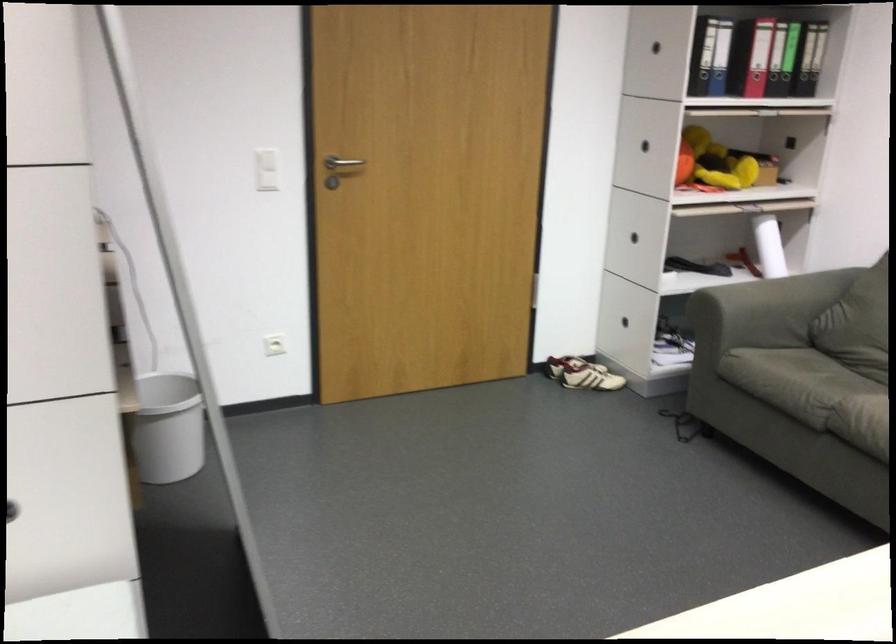
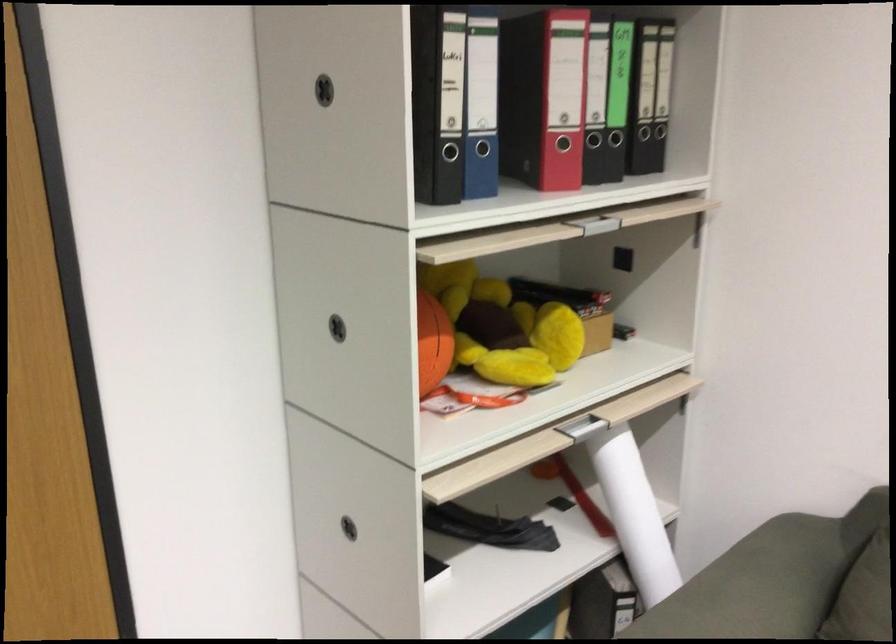
Where in the second image is the point corresponding to the point at 676,146 from the first image?

(433, 343)